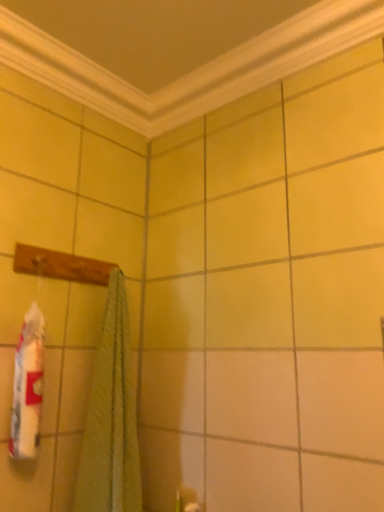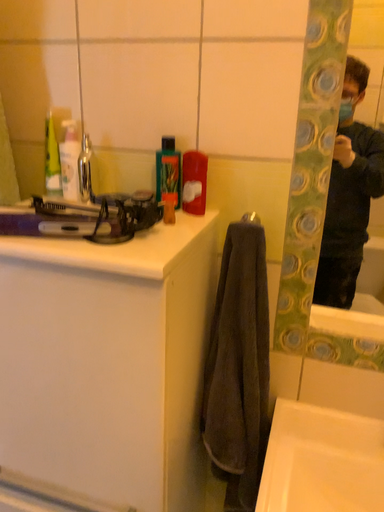
Question: How did the camera likely rotate when shooting the video?

Choices:
 (A) rotated upward
 (B) rotated downward

Answer: (B)